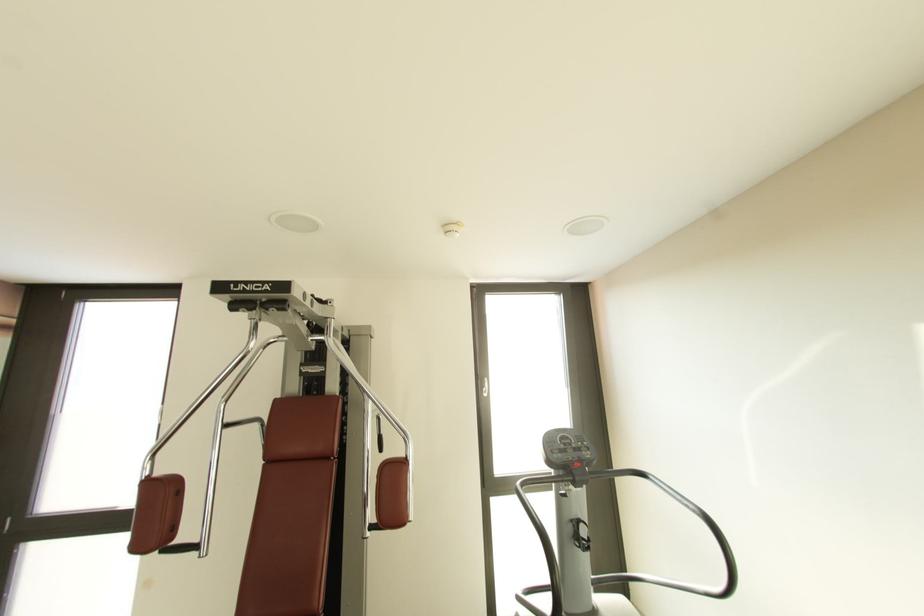
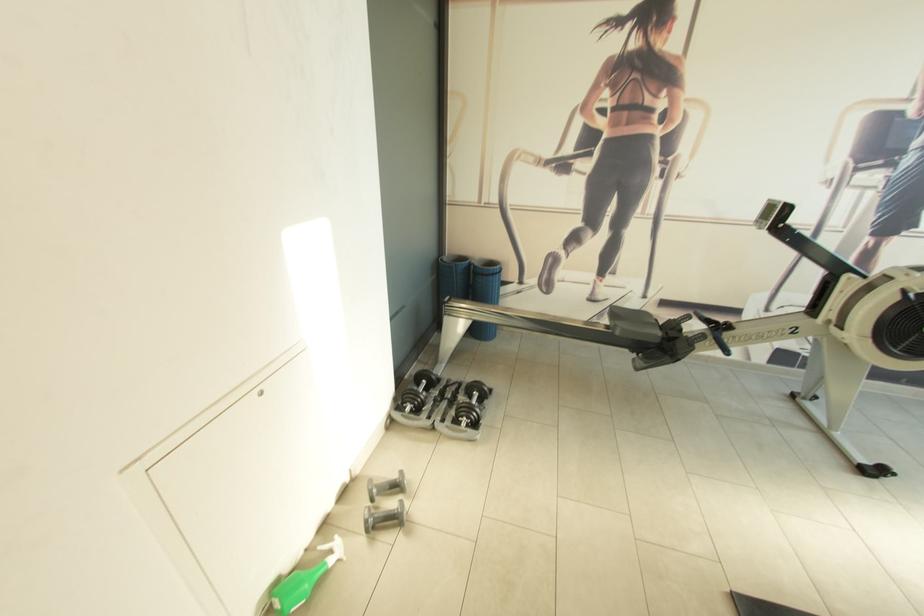
First-person continuous shooting, in which direction is the camera rotating?

The rotation direction of the camera is left-down.